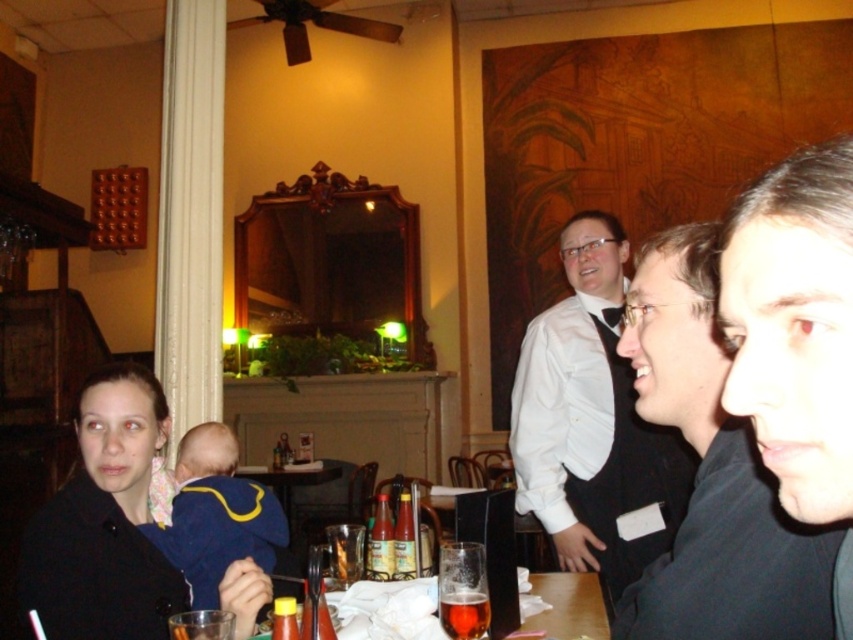
Consider the image. You are a photographer taking a picture of the scene. You notice the white shirt at upper center and the amber glass beer at lower center. Which object would appear wider in the photo?

The white shirt at upper center would appear wider in the photo since its width is larger than the amber glass beer at lower center.

You are standing in the restaurant and want to reach both points mentioned in the scene. Which point, point (816, 552) or point (202, 513), is closer to you?

Point (816, 552) is closer to the viewer than point (202, 513).